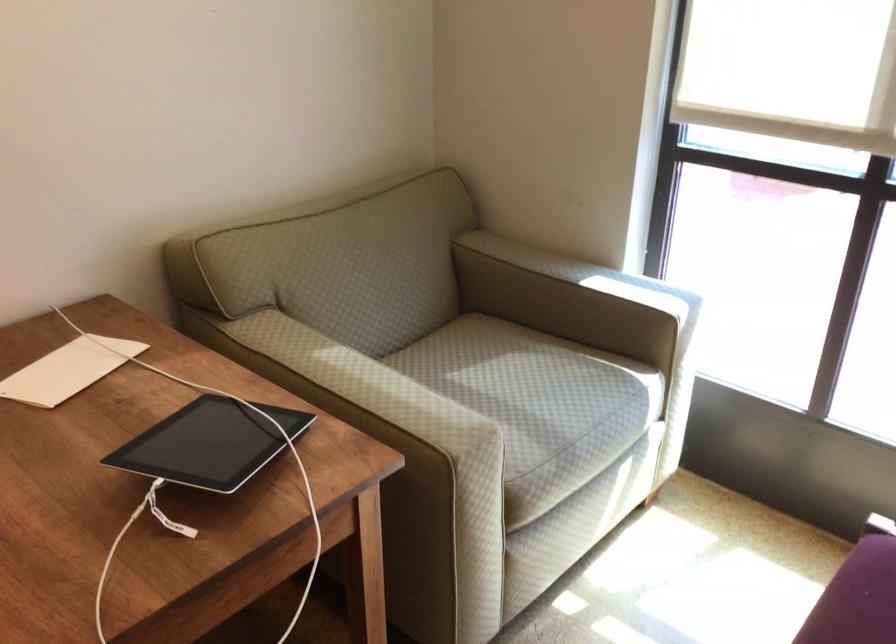
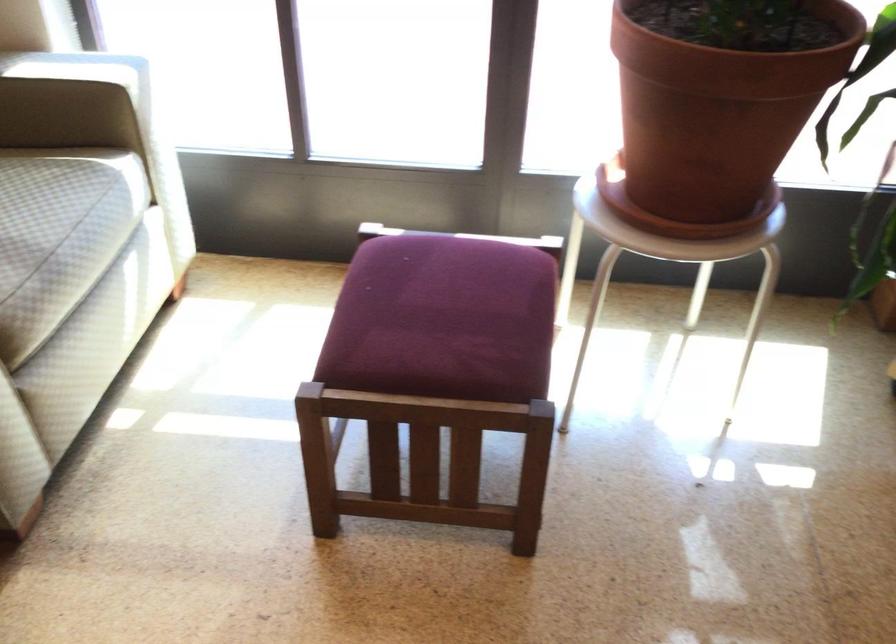
The point at (558, 408) is marked in the first image. Where is the corresponding point in the second image?

(35, 214)